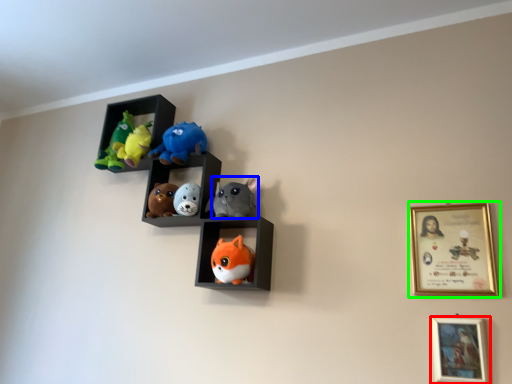
Question: Estimate the real-world distances between objects in this image. Which object is farther from picture frame (highlighted by a red box), toy (highlighted by a blue box) or picture frame (highlighted by a green box)?

Choices:
 (A) toy
 (B) picture frame

Answer: (A)